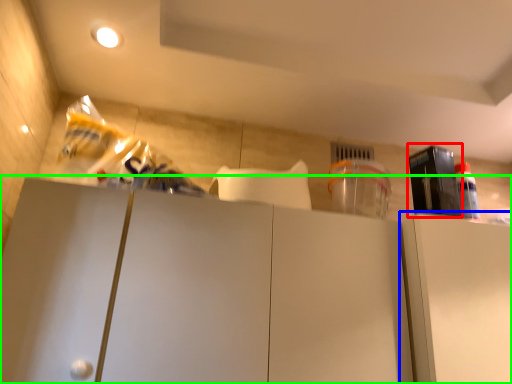
Question: Which object is the farthest from appliance (highlighted by a red box)? Choose among these: cabinetry (highlighted by a blue box) or cabinetry (highlighted by a green box).

Choices:
 (A) cabinetry
 (B) cabinetry

Answer: (B)